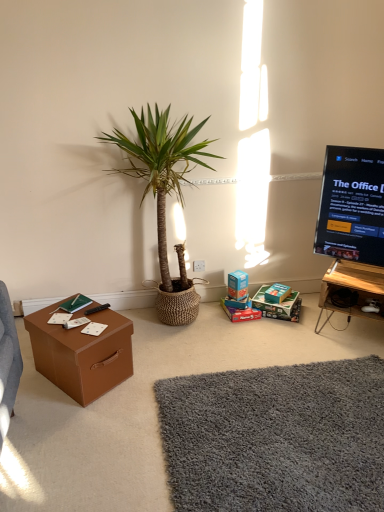
I want to click on free space in front of brown cardboard box at lower left, so tap(70, 429).